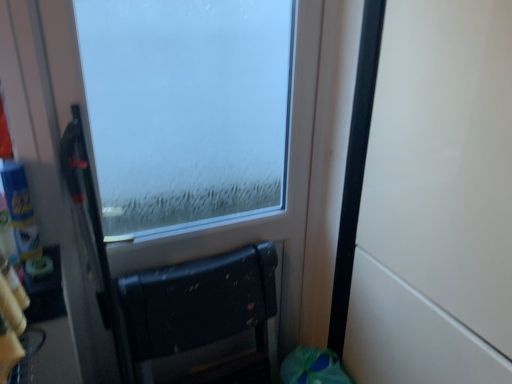
Question: From the image's perspective, is black matte chair at lower center located above frosted glass window at center?

Choices:
 (A) yes
 (B) no

Answer: (B)

Question: Can we say black matte chair at lower center lies outside frosted glass window at center?

Choices:
 (A) no
 (B) yes

Answer: (A)

Question: Is black matte chair at lower center closer to camera compared to frosted glass window at center?

Choices:
 (A) no
 (B) yes

Answer: (A)

Question: Is black matte chair at lower center bigger than frosted glass window at center?

Choices:
 (A) no
 (B) yes

Answer: (A)

Question: Does black matte chair at lower center have a lesser height compared to frosted glass window at center?

Choices:
 (A) yes
 (B) no

Answer: (A)

Question: Considering their positions, is frosted glass window at center located in front of or behind black matte chair at lower center?

Choices:
 (A) behind
 (B) front

Answer: (B)

Question: Is frosted glass window at center taller or shorter than black matte chair at lower center?

Choices:
 (A) short
 (B) tall

Answer: (B)

Question: Would you say frosted glass window at center is to the left or to the right of black matte chair at lower center in the picture?

Choices:
 (A) left
 (B) right

Answer: (B)

Question: Does point (153, 19) appear closer or farther from the camera than point (154, 304)?

Choices:
 (A) closer
 (B) farther

Answer: (A)

Question: Visually, is frosted glass window at center positioned to the left or to the right of white matte door at right?

Choices:
 (A) right
 (B) left

Answer: (B)

Question: Does point (105, 56) appear closer or farther from the camera than point (412, 195)?

Choices:
 (A) farther
 (B) closer

Answer: (A)

Question: Considering the positions of frosted glass window at center and white matte door at right in the image, is frosted glass window at center taller or shorter than white matte door at right?

Choices:
 (A) tall
 (B) short

Answer: (B)

Question: Considering their positions, is frosted glass window at center located in front of or behind white matte door at right?

Choices:
 (A) front
 (B) behind

Answer: (B)

Question: Considering the positions of black matte chair at lower center and frosted glass window at center in the image, is black matte chair at lower center wider or thinner than frosted glass window at center?

Choices:
 (A) thin
 (B) wide

Answer: (B)

Question: From a real-world perspective, is black matte chair at lower center positioned above or below frosted glass window at center?

Choices:
 (A) above
 (B) below

Answer: (B)